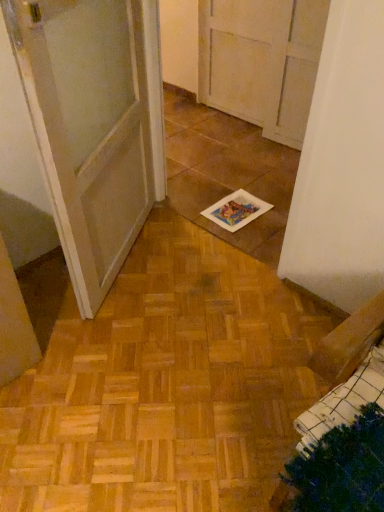
Image resolution: width=384 pixels, height=512 pixels. What do you see at coordinates (93, 125) in the screenshot? I see `white glossy door at center` at bounding box center [93, 125].

Find the location of a particular element. The width and height of the screenshot is (384, 512). white glossy door at center is located at coordinates (93, 125).

What is the approximate height of white glossy door at center?

1.00 meters.

At what (x,y) coordinates should I click in order to perform the action: click on white paper at center. Please return your answer as a coordinate pair (x, y). This screenshot has height=512, width=384. Looking at the image, I should click on (236, 210).

What is the approximate width of white paper at center?

white paper at center is 29.90 centimeters in width.

What do you see at coordinates (236, 210) in the screenshot? I see `white paper at center` at bounding box center [236, 210].

Where is `white glossy door at center`? white glossy door at center is located at coordinates (93, 125).

Which is more to the right, white paper at center or white glossy door at center?

white paper at center is more to the right.

Consider the image. In the image, is white paper at center positioned in front of or behind white glossy door at center?

Visually, white paper at center is located behind white glossy door at center.

Is point (229, 228) in front of point (105, 275)?

No, it is not.

From the image's perspective, is white paper at center on top of white glossy door at center?

No.

From a real-world perspective, who is located higher, white paper at center or white glossy door at center?

white glossy door at center.

Which object is thinner, white paper at center or white glossy door at center?

With smaller width is white glossy door at center.

Who is taller, white paper at center or white glossy door at center?

white glossy door at center.

Looking at the image, does white paper at center seem bigger or smaller compared to white glossy door at center?

white paper at center is smaller than white glossy door at center.

Is white paper at center completely or partially outside of white glossy door at center?

Yes, white paper at center is located beyond the bounds of white glossy door at center.

Are white paper at center and white glossy door at center making contact?

white paper at center and white glossy door at center are not in contact.

Could you tell me if white paper at center is turned towards white glossy door at center?

No, white paper at center is not aimed at white glossy door at center.

I want to click on door lying on the left of white paper at center, so click(x=93, y=125).

Considering the positions of objects white glossy door at center and white paper at center in the image provided, who is more to the left, white glossy door at center or white paper at center?

From the viewer's perspective, white glossy door at center appears more on the left side.

Considering the relative positions of white glossy door at center and white paper at center in the image provided, is white glossy door at center in front of white paper at center?

Yes.

Does point (88, 116) come closer to viewer compared to point (232, 213)?

Yes, point (88, 116) is closer to viewer.

From the image's perspective, is white glossy door at center positioned above or below white paper at center?

Based on their image positions, white glossy door at center is located above white paper at center.

In the scene shown: From a real-world perspective, between white glossy door at center and white paper at center, who is vertically lower?

white paper at center is physically lower.

Does white glossy door at center have a greater width compared to white paper at center?

No, white glossy door at center is not wider than white paper at center.

Looking at this image, who is taller, white glossy door at center or white paper at center?

white glossy door at center.

Which of these two, white glossy door at center or white paper at center, is bigger?

white glossy door at center.

Is white glossy door at center completely or partially outside of white paper at center?

Yes, white glossy door at center is not within white paper at center.

Is white glossy door at center touching white paper at center?

white glossy door at center and white paper at center are clearly separated.

Is white glossy door at center looking in the opposite direction of white paper at center?

That's not correct — white glossy door at center is not looking away from white paper at center.

Can you tell me how much white glossy door at center and white paper at center differ in facing direction?

56.7 degrees.

How far apart are white glossy door at center and white paper at center?

A distance of 62.21 centimeters exists between white glossy door at center and white paper at center.

Locate an element on the screen. The image size is (384, 512). book that appears below the white glossy door at center (from the image's perspective) is located at coordinates (236, 210).

The image size is (384, 512). I want to click on book behind the white glossy door at center, so click(236, 210).

Image resolution: width=384 pixels, height=512 pixels. I want to click on book located on the right of white glossy door at center, so click(236, 210).